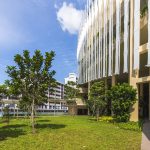
Where is `windows`? Image resolution: width=150 pixels, height=150 pixels. windows is located at coordinates (58, 91).